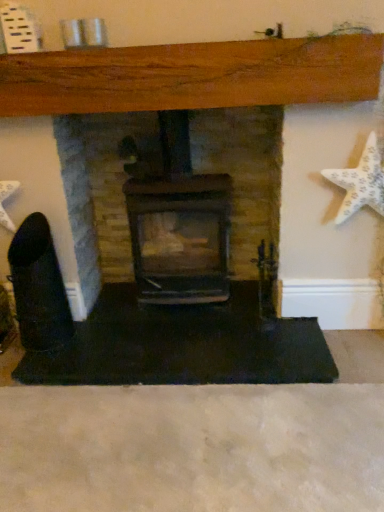
What is the approximate width of white textured starfish at right?

3.70 inches.

Where is `white textured starfish at right`? The width and height of the screenshot is (384, 512). white textured starfish at right is located at coordinates (360, 182).

Measure the distance between point (x=266, y=166) and camera.

They are 6.35 feet apart.

This screenshot has width=384, height=512. What are the coordinates of `black matte fireplace at center, the second fireplace viewed from the right` in the screenshot? It's located at (102, 193).

The image size is (384, 512). What do you see at coordinates (193, 76) in the screenshot?
I see `matte black fireplace at center, which is the second fireplace in left-to-right order` at bounding box center [193, 76].

At what (x,y) coordinates should I click in order to perform the action: click on white textured starfish at right. Please return your answer as a coordinate pair (x, y). This screenshot has width=384, height=512. Looking at the image, I should click on (360, 182).

Would you say black matte fireplace at center, marked as the 1th fireplace in a left-to-right arrangement, is outside matte black fireplace at center, which is the second fireplace in left-to-right order?

Yes, black matte fireplace at center, marked as the 1th fireplace in a left-to-right arrangement, is not within matte black fireplace at center, which is the second fireplace in left-to-right order.

Looking at this image, from a real-world perspective, does black matte fireplace at center, marked as the 1th fireplace in a left-to-right arrangement, stand above matte black fireplace at center, which is the second fireplace in left-to-right order?

No, from a real-world perspective, black matte fireplace at center, marked as the 1th fireplace in a left-to-right arrangement, is not on top of matte black fireplace at center, which is the second fireplace in left-to-right order.

Can you tell me how much black matte fireplace at center, the second fireplace viewed from the right, and matte black fireplace at center, which is the second fireplace in left-to-right order, differ in facing direction?

1.02 degrees separate the facing orientations of black matte fireplace at center, the second fireplace viewed from the right, and matte black fireplace at center, which is the second fireplace in left-to-right order.

Could you measure the distance between black matte fireplace at center, marked as the 1th fireplace in a left-to-right arrangement, and matte black fireplace at center, which is the 1th fireplace from right to left?

The distance of black matte fireplace at center, marked as the 1th fireplace in a left-to-right arrangement, from matte black fireplace at center, which is the 1th fireplace from right to left, is 18.57 inches.

In the scene shown: Which is correct: matte black fireplace at center, which is the 1th fireplace from right to left, is inside white textured starfish at right, or outside of it?

matte black fireplace at center, which is the 1th fireplace from right to left, is outside white textured starfish at right.

Which is in front, matte black fireplace at center, which is the 1th fireplace from right to left, or white textured starfish at right?

matte black fireplace at center, which is the 1th fireplace from right to left.

In terms of height, does matte black fireplace at center, which is the 1th fireplace from right to left, look taller or shorter compared to white textured starfish at right?

In the image, matte black fireplace at center, which is the 1th fireplace from right to left, appears to be taller than white textured starfish at right.

Is point (134, 72) closer or farther from the camera than point (337, 222)?

Point (134, 72) is positioned closer to the camera compared to point (337, 222).

From a real-world perspective, is matte black fireplace at center, which is the 1th fireplace from right to left, over black matte fireplace at center, the second fireplace viewed from the right?

Yes, from a real-world perspective, matte black fireplace at center, which is the 1th fireplace from right to left, is on top of black matte fireplace at center, the second fireplace viewed from the right.

Are matte black fireplace at center, which is the second fireplace in left-to-right order, and black matte fireplace at center, the second fireplace viewed from the right, far apart?

They are positioned close to each other.

Is matte black fireplace at center, which is the second fireplace in left-to-right order, facing towards black matte fireplace at center, the second fireplace viewed from the right?

Yes, matte black fireplace at center, which is the second fireplace in left-to-right order, is oriented towards black matte fireplace at center, the second fireplace viewed from the right.

Considering the relative positions of white textured starfish at right and black matte fireplace at center, the second fireplace viewed from the right, in the image provided, is white textured starfish at right behind black matte fireplace at center, the second fireplace viewed from the right,?

No, white textured starfish at right is closer to the camera.

How distant is white textured starfish at right from black matte fireplace at center, the second fireplace viewed from the right?

A distance of 26.29 inches exists between white textured starfish at right and black matte fireplace at center, the second fireplace viewed from the right.

Is white textured starfish at right facing away from black matte fireplace at center, the second fireplace viewed from the right?

That's not correct — white textured starfish at right is not looking away from black matte fireplace at center, the second fireplace viewed from the right.

Looking at this image, is white textured starfish at right to the right of black matte fireplace at center, the second fireplace viewed from the right, from the viewer's perspective?

Correct, you'll find white textured starfish at right to the right of black matte fireplace at center, the second fireplace viewed from the right.

In the image, there is a matte black fireplace at center, which is the second fireplace in left-to-right order. Where is `starfish above it (from the image's perspective)`? starfish above it (from the image's perspective) is located at coordinates (360, 182).

From the image's perspective, which one is positioned higher, white textured starfish at right or matte black fireplace at center, which is the 1th fireplace from right to left?

white textured starfish at right.

Is white textured starfish at right spatially inside matte black fireplace at center, which is the 1th fireplace from right to left, or outside of it?

white textured starfish at right lies outside matte black fireplace at center, which is the 1th fireplace from right to left.

Is white textured starfish at right in front of or behind matte black fireplace at center, which is the second fireplace in left-to-right order, in the image?

In the image, white textured starfish at right appears behind matte black fireplace at center, which is the second fireplace in left-to-right order.

Considering the sizes of objects black matte fireplace at center, marked as the 1th fireplace in a left-to-right arrangement, and white textured starfish at right in the image provided, who is smaller, black matte fireplace at center, marked as the 1th fireplace in a left-to-right arrangement, or white textured starfish at right?

white textured starfish at right.

From a real-world perspective, is black matte fireplace at center, the second fireplace viewed from the right, under white textured starfish at right?

Correct, in the physical world, black matte fireplace at center, the second fireplace viewed from the right, is lower than white textured starfish at right.

Is black matte fireplace at center, marked as the 1th fireplace in a left-to-right arrangement, oriented towards white textured starfish at right?

No, black matte fireplace at center, marked as the 1th fireplace in a left-to-right arrangement, is not aimed at white textured starfish at right.

From the white textured starfish at right, count the 2nd fireplace to the left and point to it. Please provide its 2D coordinates.

[(102, 193)]

The width and height of the screenshot is (384, 512). Find the location of `fireplace that appears on the left of matte black fireplace at center, which is the 1th fireplace from right to left`. fireplace that appears on the left of matte black fireplace at center, which is the 1th fireplace from right to left is located at coordinates pyautogui.click(x=102, y=193).

The height and width of the screenshot is (512, 384). I want to click on fireplace in front of the white textured starfish at right, so click(x=193, y=76).

From the image, which object appears to be nearer to matte black fireplace at center, which is the second fireplace in left-to-right order, black matte fireplace at center, marked as the 1th fireplace in a left-to-right arrangement, or white textured starfish at right?

black matte fireplace at center, marked as the 1th fireplace in a left-to-right arrangement, lies closer to matte black fireplace at center, which is the second fireplace in left-to-right order, than the other object.

Which object lies nearer to the anchor point black matte fireplace at center, marked as the 1th fireplace in a left-to-right arrangement, white textured starfish at right or matte black fireplace at center, which is the second fireplace in left-to-right order?

matte black fireplace at center, which is the second fireplace in left-to-right order.

Looking at the image, which one is located closer to black matte fireplace at center, the second fireplace viewed from the right, matte black fireplace at center, which is the second fireplace in left-to-right order, or white textured starfish at right?

Based on the image, matte black fireplace at center, which is the second fireplace in left-to-right order, appears to be nearer to black matte fireplace at center, the second fireplace viewed from the right.

Based on their spatial positions, is black matte fireplace at center, marked as the 1th fireplace in a left-to-right arrangement, or matte black fireplace at center, which is the 1th fireplace from right to left, further from white textured starfish at right?

Based on the image, black matte fireplace at center, marked as the 1th fireplace in a left-to-right arrangement, appears to be further to white textured starfish at right.

Looking at the image, which one is located closer to matte black fireplace at center, which is the 1th fireplace from right to left, white textured starfish at right or black matte fireplace at center, marked as the 1th fireplace in a left-to-right arrangement?

The object closer to matte black fireplace at center, which is the 1th fireplace from right to left, is black matte fireplace at center, marked as the 1th fireplace in a left-to-right arrangement.

From the image, which object appears to be farther from white textured starfish at right, matte black fireplace at center, which is the second fireplace in left-to-right order, or black matte fireplace at center, the second fireplace viewed from the right?

black matte fireplace at center, the second fireplace viewed from the right, is further to white textured starfish at right.

Where is `fireplace between black matte fireplace at center, marked as the 1th fireplace in a left-to-right arrangement, and white textured starfish at right, in the horizontal direction`? The image size is (384, 512). fireplace between black matte fireplace at center, marked as the 1th fireplace in a left-to-right arrangement, and white textured starfish at right, in the horizontal direction is located at coordinates (193, 76).